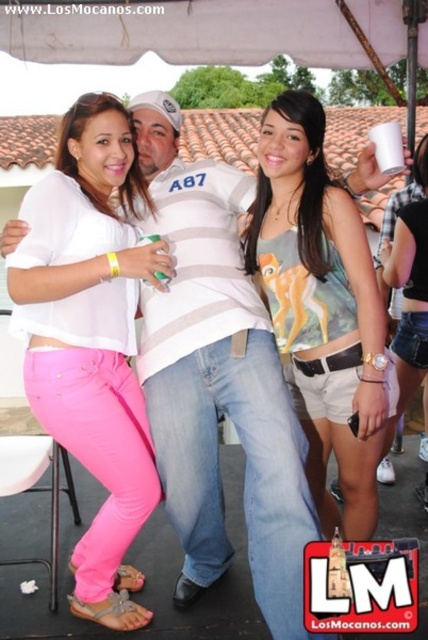
Is point (246, 48) behind point (44, 440)?

Yes, it is.

Which is below, white fabric canopy at upper center or pink fabric stool at lower left?

pink fabric stool at lower left

The width and height of the screenshot is (428, 640). What do you see at coordinates (181, 32) in the screenshot?
I see `white fabric canopy at upper center` at bounding box center [181, 32].

At what (x,y) coordinates should I click in order to perform the action: click on white fabric canopy at upper center. Please return your answer as a coordinate pair (x, y). Looking at the image, I should click on (181, 32).

Which is below, matte pink pants at center or white fabric canopy at upper center?

matte pink pants at center

Can you confirm if matte pink pants at center is smaller than white fabric canopy at upper center?

No, matte pink pants at center is not smaller than white fabric canopy at upper center.

Which is in front, point (91, 97) or point (207, 45)?

Point (91, 97) is more forward.

The width and height of the screenshot is (428, 640). Identify the location of matte pink pants at center. (92, 340).

Does white matte cup at upper center have a larger size compared to green plastic cup at center?

Indeed, white matte cup at upper center has a larger size compared to green plastic cup at center.

Which is behind, point (379, 145) or point (142, 241)?

Positioned behind is point (379, 145).

Which is behind, point (377, 141) or point (160, 240)?

Positioned behind is point (377, 141).

The image size is (428, 640). I want to click on white matte cup at upper center, so click(388, 147).